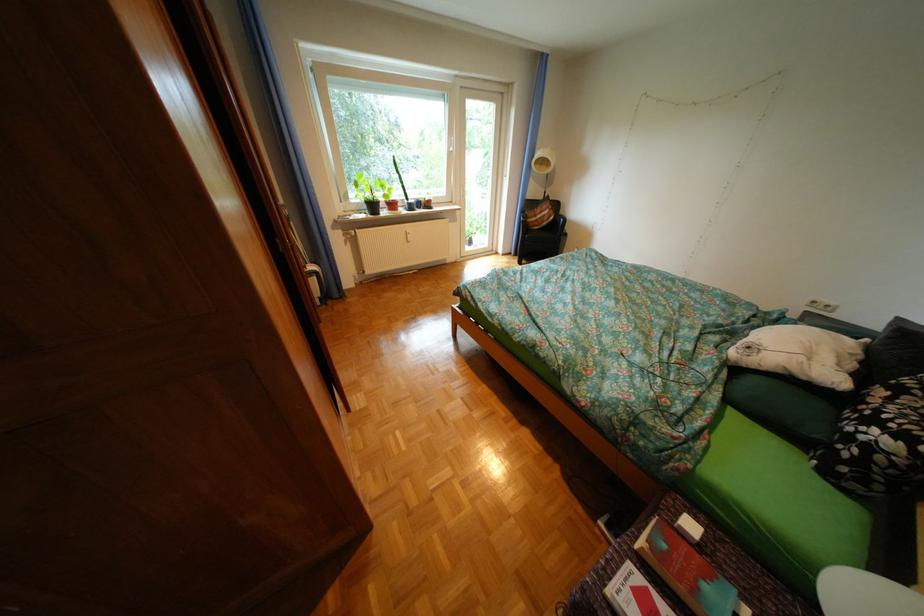
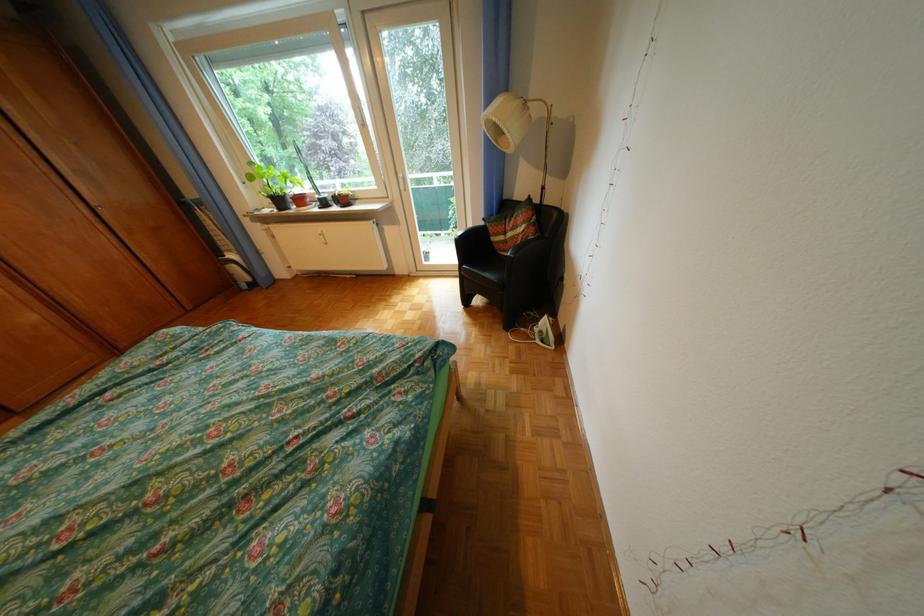
Where in the second image is the point corresponding to the point at 553,217 from the first image?

(524, 236)